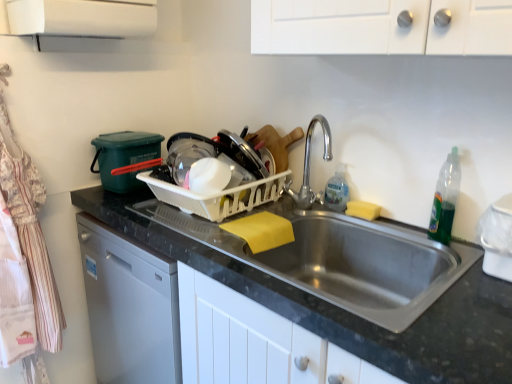
Where is `free space between green translucent bottle at right and yellow sponge at sink right`? This screenshot has width=512, height=384. free space between green translucent bottle at right and yellow sponge at sink right is located at coordinates (399, 227).